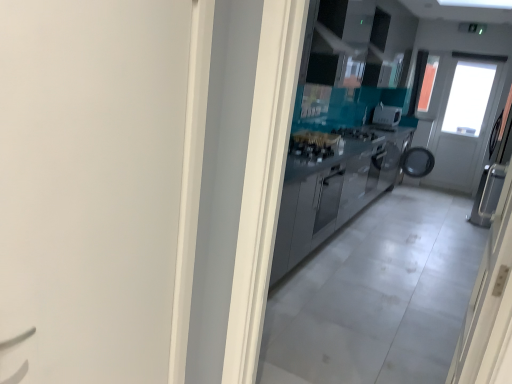
Question: Are satin silver door at right, acting as the second door starting from the left, and satin silver cabinetry at center beside each other?

Choices:
 (A) yes
 (B) no

Answer: (B)

Question: Is satin silver door at right, acting as the second door starting from the left, located outside satin silver cabinetry at center?

Choices:
 (A) yes
 (B) no

Answer: (A)

Question: Is satin silver door at right, acting as the second door starting from the left, bigger than satin silver cabinetry at center?

Choices:
 (A) no
 (B) yes

Answer: (A)

Question: From the image's perspective, is satin silver door at right, acting as the first door starting from the right, under satin silver cabinetry at center?

Choices:
 (A) yes
 (B) no

Answer: (A)

Question: Could you tell me if satin silver door at right, acting as the first door starting from the right, is facing satin silver cabinetry at center?

Choices:
 (A) yes
 (B) no

Answer: (B)

Question: From a real-world perspective, is satin silver door at right, acting as the first door starting from the right, physically located above or below satin silver toaster at center?

Choices:
 (A) above
 (B) below

Answer: (B)

Question: Considering their positions, is satin silver door at right, acting as the first door starting from the right, located in front of or behind satin silver toaster at center?

Choices:
 (A) behind
 (B) front

Answer: (B)

Question: Is satin silver door at right, acting as the second door starting from the left, wider or thinner than satin silver toaster at center?

Choices:
 (A) wide
 (B) thin

Answer: (B)

Question: Considering the positions of satin silver door at right, acting as the first door starting from the right, and satin silver toaster at center in the image, is satin silver door at right, acting as the first door starting from the right, bigger or smaller than satin silver toaster at center?

Choices:
 (A) small
 (B) big

Answer: (B)

Question: Would you say satin silver toaster at center is inside or outside satin silver door at right, acting as the second door starting from the left?

Choices:
 (A) inside
 (B) outside

Answer: (B)

Question: In terms of width, does satin silver toaster at center look wider or thinner when compared to satin silver door at right, acting as the first door starting from the right?

Choices:
 (A) thin
 (B) wide

Answer: (B)

Question: In the image, is satin silver toaster at center positioned in front of or behind satin silver door at right, acting as the second door starting from the left?

Choices:
 (A) behind
 (B) front

Answer: (A)

Question: From the image's perspective, is satin silver toaster at center above or below satin silver door at right, acting as the second door starting from the left?

Choices:
 (A) above
 (B) below

Answer: (A)

Question: Choose the correct answer: Is satin silver door at right, acting as the first door starting from the right, inside satin silver cabinetry at center or outside it?

Choices:
 (A) inside
 (B) outside

Answer: (B)

Question: From a real-world perspective, is satin silver door at right, acting as the first door starting from the right, physically located above or below satin silver cabinetry at center?

Choices:
 (A) below
 (B) above

Answer: (B)